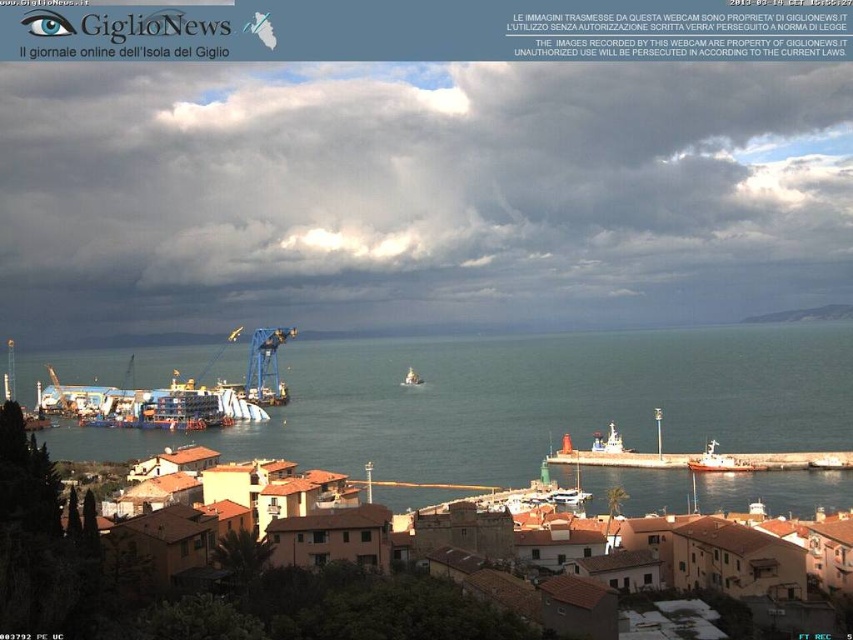
Does brown matte building at lower center appear on the right side of metallic silver boat at center?

Correct, you'll find brown matte building at lower center to the right of metallic silver boat at center.

Is brown matte building at lower center to the left of metallic silver boat at center from the viewer's perspective?

No, brown matte building at lower center is not to the left of metallic silver boat at center.

Between point (445, 618) and point (410, 372), which one is positioned in front?

Point (445, 618) is more forward.

The height and width of the screenshot is (640, 853). I want to click on brown matte building at lower center, so click(x=355, y=608).

Can you confirm if metallic silver boat at lower right is thinner than metallic silver boat at center?

No, metallic silver boat at lower right is not thinner than metallic silver boat at center.

Find the location of a particular element. The height and width of the screenshot is (640, 853). metallic silver boat at lower right is located at coordinates (714, 460).

The image size is (853, 640). What are the coordinates of `metallic silver boat at lower right` in the screenshot? It's located at (714, 460).

Does blue water at center appear on the right side of brown matte building at lower center?

Yes, blue water at center is to the right of brown matte building at lower center.

Between blue water at center and brown matte building at lower center, which one has less height?

Standing shorter between the two is brown matte building at lower center.

Measure the distance between blue water at center and camera.

215.71 meters

The width and height of the screenshot is (853, 640). Find the location of `blue water at center`. blue water at center is located at coordinates (527, 401).